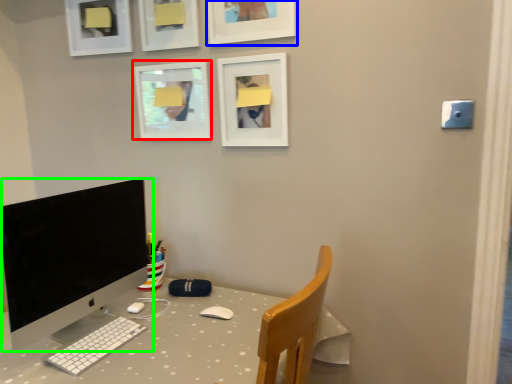
Question: Considering the real-world distances, which object is closest to picture frame (highlighted by a red box)? picture frame (highlighted by a blue box) or computer monitor (highlighted by a green box).

Choices:
 (A) picture frame
 (B) computer monitor

Answer: (A)